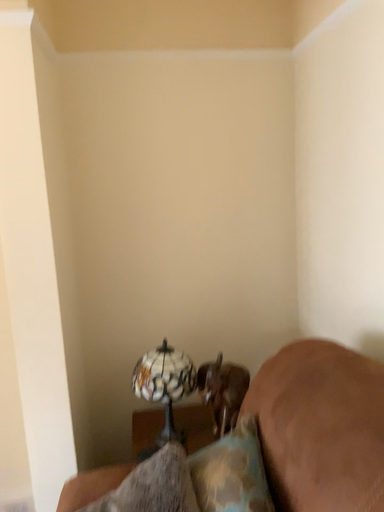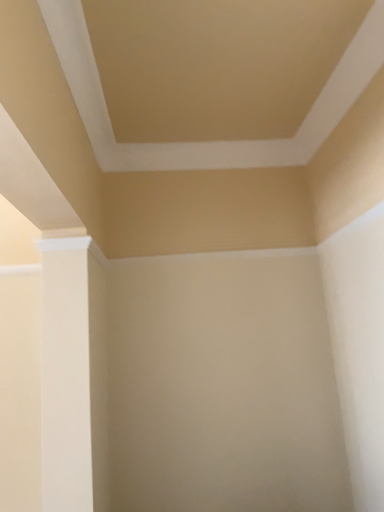
Question: How did the camera likely rotate when shooting the video?

Choices:
 (A) rotated downward
 (B) rotated upward

Answer: (B)